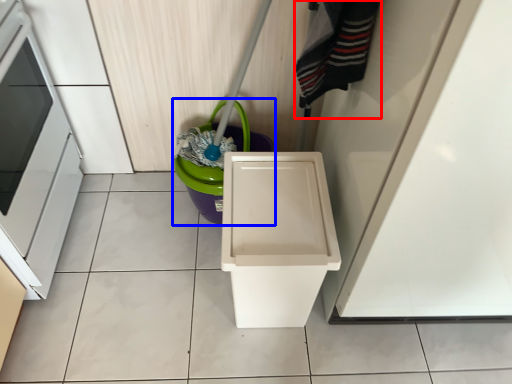
Question: Which of the following is the closest to the observer, clothing (highlighted by a red box) or potty (highlighted by a blue box)?

Choices:
 (A) clothing
 (B) potty

Answer: (A)